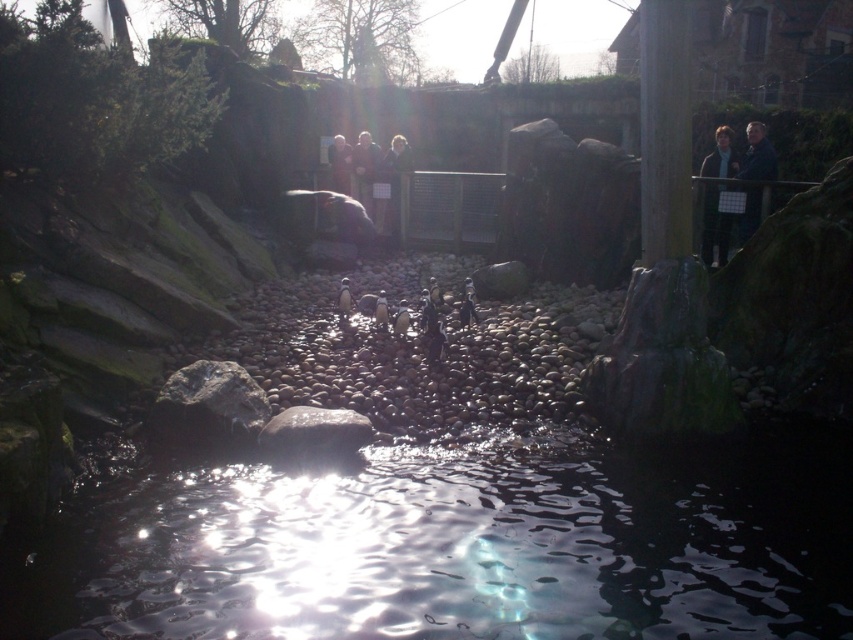
Question: Is dark blue sweater at upper right positioned in front of dark brown leather jacket at center?

Choices:
 (A) yes
 (B) no

Answer: (A)

Question: Considering the real-world distances, which object is farthest from the dark blue jacket at upper right?

Choices:
 (A) smooth skin person at center
 (B) dark brown leather jacket at center
 (C) dark blue sweater at upper right

Answer: (A)

Question: Observing the image, what is the correct spatial positioning of dark blue sweater at upper right in reference to smooth skin person at center?

Choices:
 (A) below
 (B) above

Answer: (A)

Question: Is dark blue sweater at upper right bigger than dark blue jacket at upper right?

Choices:
 (A) no
 (B) yes

Answer: (A)

Question: Which point is closer to the camera?

Choices:
 (A) dark blue sweater at upper right
 (B) transparent water at center

Answer: (B)

Question: Which point is closer to the camera taking this photo?

Choices:
 (A) (370, 161)
 (B) (761, 172)
 (C) (395, 152)
 (D) (721, 227)

Answer: (B)